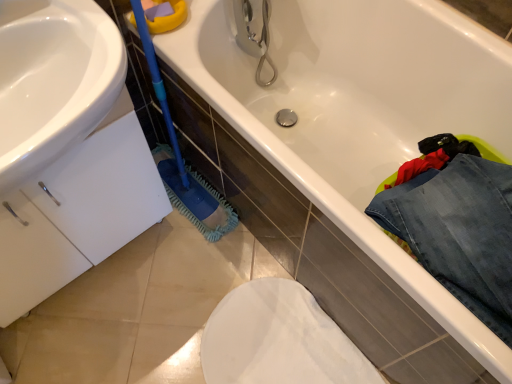
Question: Is point (390, 215) closer or farther from the camera than point (194, 173)?

Choices:
 (A) closer
 (B) farther

Answer: (A)

Question: From their relative heights in the image, would you say denim jeans at lower right is taller or shorter than blue microfiber brush at lower left?

Choices:
 (A) tall
 (B) short

Answer: (B)

Question: Is denim jeans at lower right in front of or behind blue microfiber brush at lower left in the image?

Choices:
 (A) front
 (B) behind

Answer: (B)

Question: Which is correct: blue microfiber brush at lower left is inside denim jeans at lower right, or outside of it?

Choices:
 (A) inside
 (B) outside

Answer: (B)

Question: Would you say blue microfiber brush at lower left is to the left or to the right of denim jeans at lower right in the picture?

Choices:
 (A) right
 (B) left

Answer: (B)

Question: Is point (138, 13) closer or farther from the camera than point (440, 244)?

Choices:
 (A) farther
 (B) closer

Answer: (A)

Question: From a real-world perspective, is blue microfiber brush at lower left above or below denim jeans at lower right?

Choices:
 (A) below
 (B) above

Answer: (A)